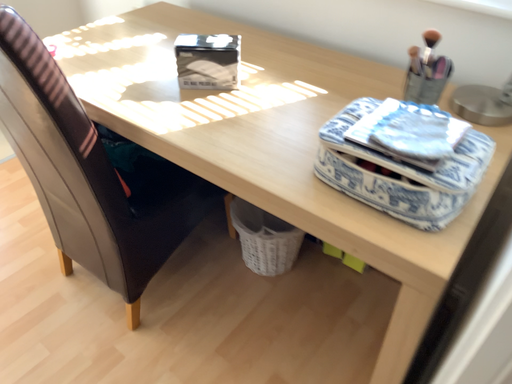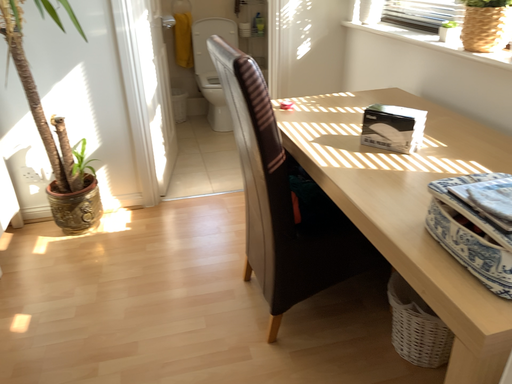
Question: Which way did the camera rotate in the video?

Choices:
 (A) rotated upward
 (B) rotated downward

Answer: (A)